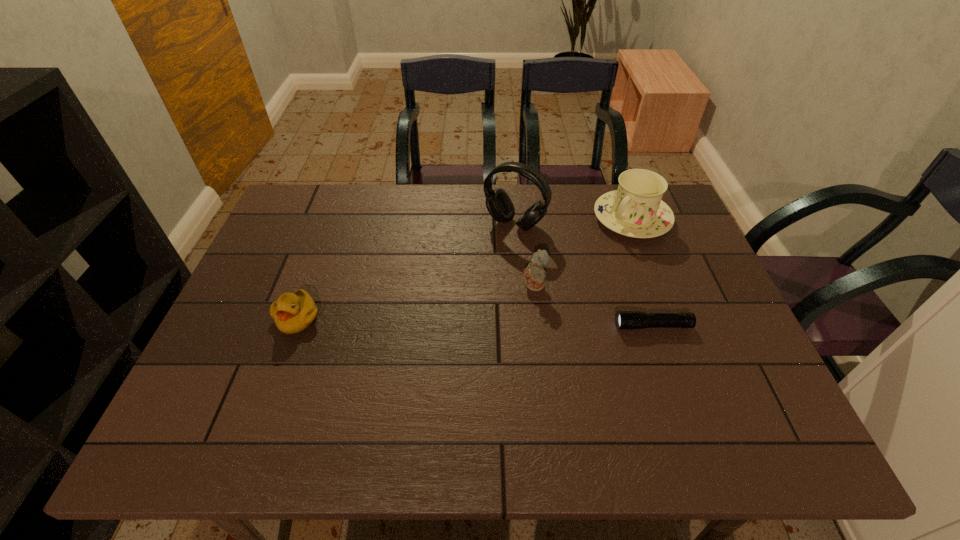
This screenshot has width=960, height=540. I want to click on vacant space located on the front-facing side of the teddy bear, so click(484, 313).

The height and width of the screenshot is (540, 960). What are the coordinates of `vacant space located on the front-facing side of the teddy bear` in the screenshot? It's located at (440, 335).

At what (x,y) coordinates should I click in order to perform the action: click on vacant area situated on the front-facing side of the teddy bear. Please return your answer as a coordinate pair (x, y). This screenshot has height=540, width=960. Looking at the image, I should click on (500, 304).

Image resolution: width=960 pixels, height=540 pixels. What are the coordinates of `vacant space located 0.180m on the handle side of the chinaware` in the screenshot? It's located at (578, 268).

I want to click on vacant space located on the handle side of the chinaware, so click(x=593, y=254).

At what (x,y) coordinates should I click in order to perform the action: click on vacant space located 0.280m on the handle side of the chinaware. Please return your answer as a coordinate pair (x, y). The height and width of the screenshot is (540, 960). Looking at the image, I should click on (557, 288).

Find the location of `blank space located on the earcups of the tallest object`. blank space located on the earcups of the tallest object is located at coordinates (483, 261).

This screenshot has width=960, height=540. Find the location of `blank area located 0.130m on the earcups of the tallest object`. blank area located 0.130m on the earcups of the tallest object is located at coordinates (481, 264).

This screenshot has width=960, height=540. I want to click on vacant space positioned 0.070m on the earcups of the tallest object, so click(491, 251).

Where is `chinaware at the far edge`? chinaware at the far edge is located at coordinates (636, 210).